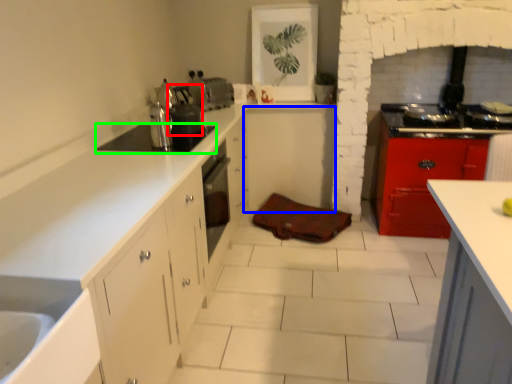
Question: Which object is the closest to the appliance (highlighted by a red box)? Choose among these: cabinetry (highlighted by a blue box) or appliance (highlighted by a green box).

Choices:
 (A) cabinetry
 (B) appliance

Answer: (B)